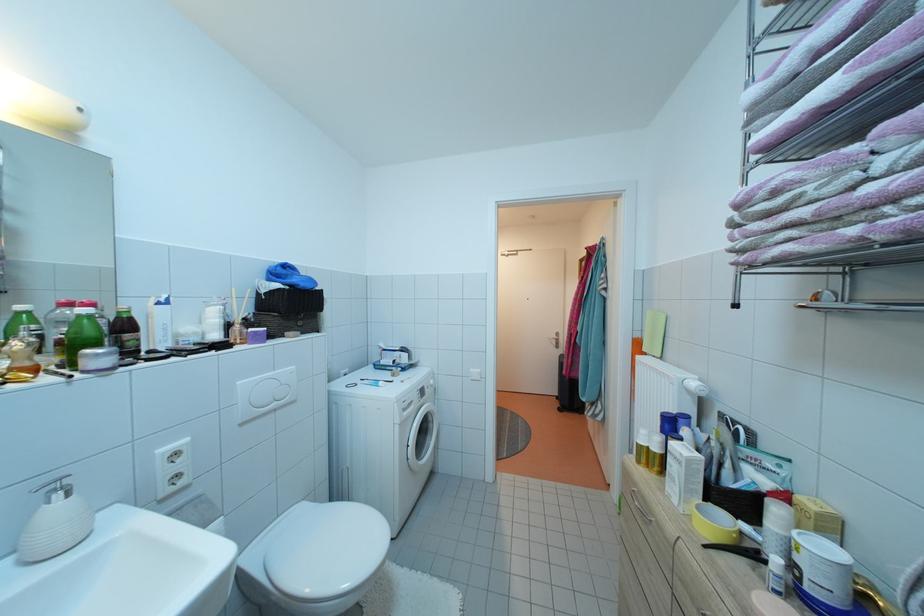
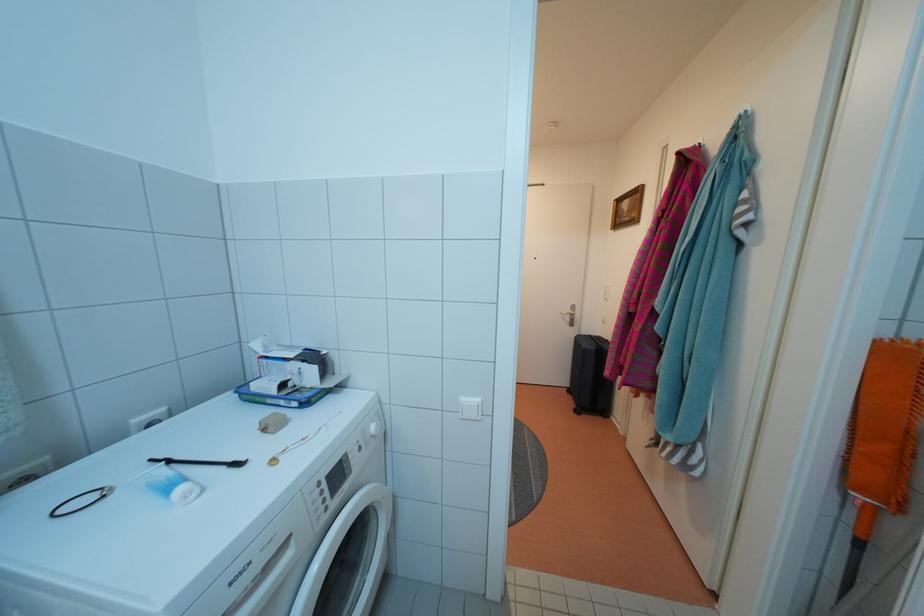
The point at (x=558, y=347) is marked in the first image. Where is the corresponding point in the second image?

(570, 323)